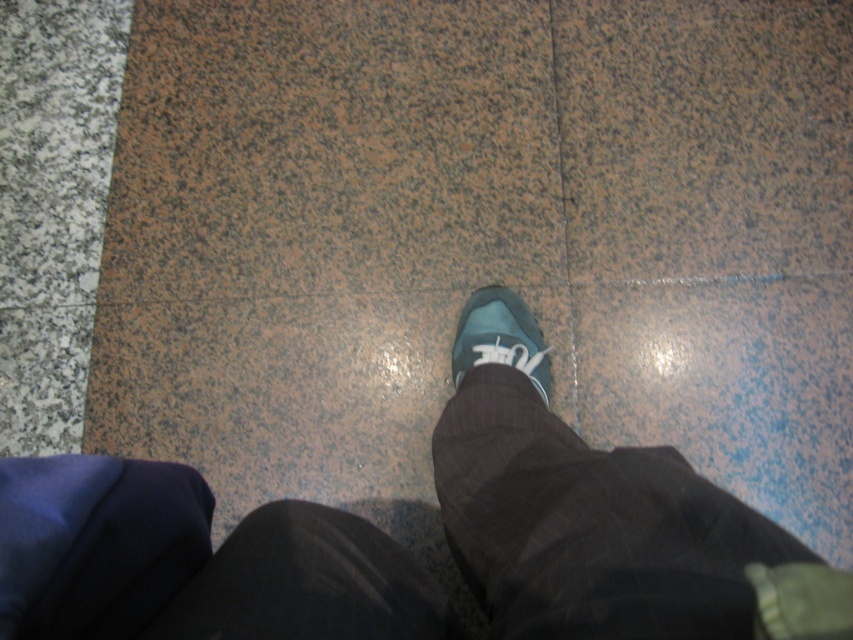
Is the position of matte blue shoe at center more distant than that of matte blue sneaker at center?

No, matte blue shoe at center is closer to the viewer.

Does matte blue shoe at center appear on the left side of matte blue sneaker at center?

Correct, you'll find matte blue shoe at center to the left of matte blue sneaker at center.

Who is more distant from viewer, (201,484) or (520,310)?

Point (520,310)

Locate an element on the screen. The image size is (853, 640). matte blue shoe at center is located at coordinates (611, 532).